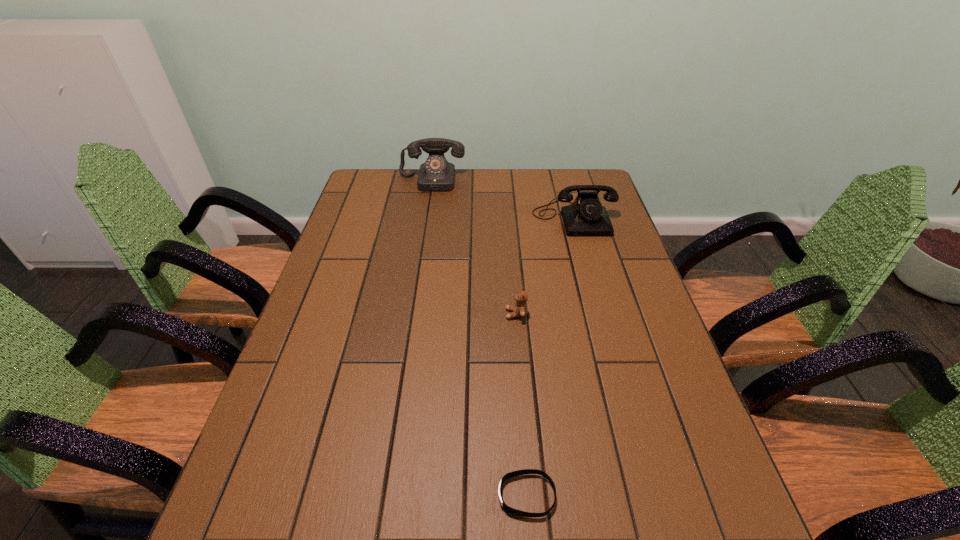
I want to click on the farthest object, so click(436, 174).

This screenshot has width=960, height=540. Identify the location of the left telephone. click(x=436, y=174).

Where is `the second tallest object`? The image size is (960, 540). the second tallest object is located at coordinates (586, 216).

You are a GUI agent. You are given a task and a screenshot of the screen. Output one action in this format:
    pyautogui.click(x=<x>, y=<y>)
    Task: Click on the right telephone
    This screenshot has width=960, height=540.
    Given the screenshot: What is the action you would take?
    pyautogui.click(x=586, y=216)

You are a GUI agent. You are given a task and a screenshot of the screen. Output one action in this format:
    pyautogui.click(x=<x>, y=<y>)
    Task: Click on the teddy bear
    The width and height of the screenshot is (960, 540).
    Given the screenshot: What is the action you would take?
    pyautogui.click(x=519, y=309)

What are the coordinates of `the second shortest object` in the screenshot? It's located at (519, 309).

Where is `the shortest object`? the shortest object is located at coordinates (525, 471).

You are a GUI agent. You are given a task and a screenshot of the screen. Output one action in this format:
    pyautogui.click(x=<x>, y=<y>)
    Task: Click on the wristband
    Image resolution: width=960 pixels, height=540 pixels.
    Given the screenshot: What is the action you would take?
    pyautogui.click(x=525, y=471)

Find the location of `blank space located on the dial of the farther telephone`. blank space located on the dial of the farther telephone is located at coordinates (422, 240).

Where is `vacant space positioned 0.370m on the front face of the right telephone`? The width and height of the screenshot is (960, 540). vacant space positioned 0.370m on the front face of the right telephone is located at coordinates (x=604, y=323).